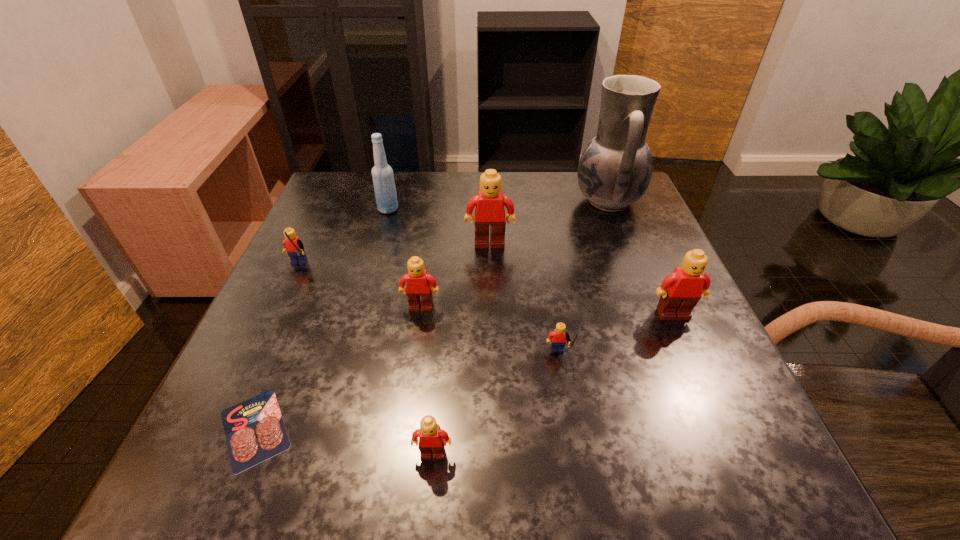
Locate an element on the screen. The width and height of the screenshot is (960, 540). the tallest object is located at coordinates (615, 169).

Find the location of `the third object from left to right`. the third object from left to right is located at coordinates (383, 179).

At what (x,y) coordinates should I click in order to perform the action: click on the farthest Lego. Please return your answer as a coordinate pair (x, y). This screenshot has width=960, height=540. Looking at the image, I should click on (490, 210).

Locate an element on the screen. The height and width of the screenshot is (540, 960). the farthest brown Lego is located at coordinates (490, 210).

Locate an element on the screen. the second tallest Lego is located at coordinates (681, 290).

The width and height of the screenshot is (960, 540). What are the coordinates of `the rightmost brown Lego` in the screenshot? It's located at coord(681,290).

The width and height of the screenshot is (960, 540). I want to click on the third biggest brown Lego, so click(418, 290).

Where is `the second farthest Lego`? the second farthest Lego is located at coordinates (292, 244).

At what (x,y) coordinates should I click in order to perform the action: click on the fourth farthest object. Please return your answer as a coordinate pair (x, y). The height and width of the screenshot is (540, 960). Looking at the image, I should click on (292, 244).

This screenshot has height=540, width=960. In order to click on the smaller yellow Lego in this screenshot , I will do `click(557, 338)`.